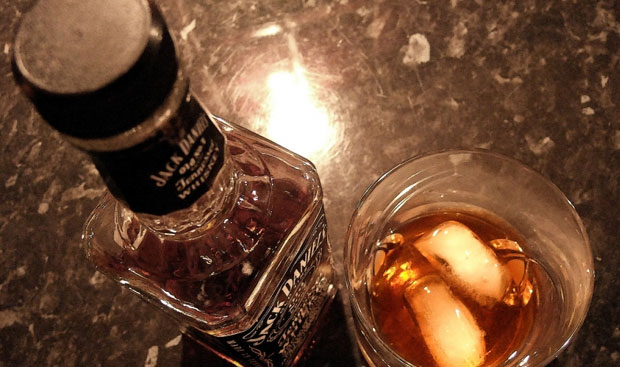
This screenshot has height=367, width=620. What are the coordinates of `glass design` in the screenshot? It's located at (232, 244).